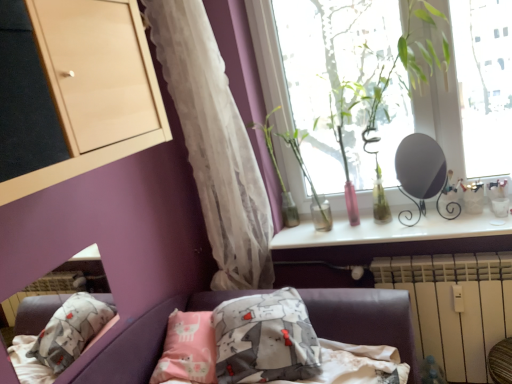
Question: Can you confirm if green glass vase at upper center, arranged as the 2th plant when viewed from the left, is smaller than translucent white curtain at left?

Choices:
 (A) yes
 (B) no

Answer: (A)

Question: Does green glass vase at upper center, arranged as the 2th plant when viewed from the left, lie behind translucent white curtain at left?

Choices:
 (A) no
 (B) yes

Answer: (B)

Question: Is green glass vase at upper center, arranged as the 2th plant when viewed from the left, turned away from translucent white curtain at left?

Choices:
 (A) no
 (B) yes

Answer: (A)

Question: Does green glass vase at upper center, which appears as the first plant when viewed from the right, appear on the left side of translucent white curtain at left?

Choices:
 (A) no
 (B) yes

Answer: (A)

Question: From a real-world perspective, is green glass vase at upper center, which appears as the first plant when viewed from the right, below translucent white curtain at left?

Choices:
 (A) yes
 (B) no

Answer: (A)

Question: Relative to white plastic radiator at lower right, is translucent white curtain at left in front or behind?

Choices:
 (A) front
 (B) behind

Answer: (A)

Question: Does point (190, 119) appear closer or farther from the camera than point (484, 332)?

Choices:
 (A) farther
 (B) closer

Answer: (A)

Question: Is translucent white curtain at left bigger or smaller than white plastic radiator at lower right?

Choices:
 (A) small
 (B) big

Answer: (B)

Question: Choose the correct answer: Is translucent white curtain at left inside white plastic radiator at lower right or outside it?

Choices:
 (A) outside
 (B) inside

Answer: (A)

Question: Is white plastic radiator at lower right taller or shorter than green glass vase at upper center, which appears as the first plant when viewed from the right?

Choices:
 (A) tall
 (B) short

Answer: (A)

Question: Looking at their shapes, would you say white plastic radiator at lower right is wider or thinner than green glass vase at upper center, arranged as the 2th plant when viewed from the left?

Choices:
 (A) thin
 (B) wide

Answer: (A)

Question: Based on their sizes in the image, would you say white plastic radiator at lower right is bigger or smaller than green glass vase at upper center, which appears as the first plant when viewed from the right?

Choices:
 (A) small
 (B) big

Answer: (B)

Question: Do you think white plastic radiator at lower right is within green glass vase at upper center, which appears as the first plant when viewed from the right, or outside of it?

Choices:
 (A) inside
 (B) outside

Answer: (B)

Question: Visually, is matte black mirror at upper right positioned to the left or to the right of green glass vase at upper center, arranged as the 2th plant when viewed from the left?

Choices:
 (A) right
 (B) left

Answer: (A)

Question: From a real-world perspective, relative to green glass vase at upper center, which appears as the first plant when viewed from the right, is matte black mirror at upper right vertically above or below?

Choices:
 (A) above
 (B) below

Answer: (B)